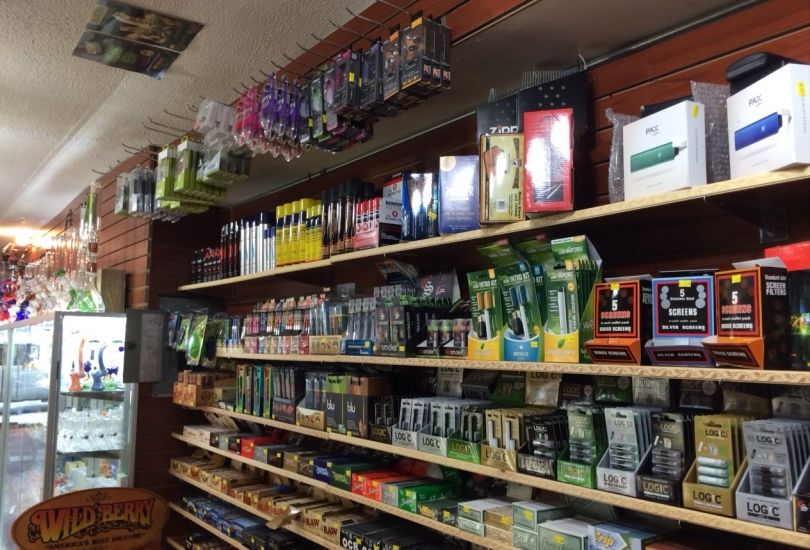
Where is `poster`? The width and height of the screenshot is (810, 550). poster is located at coordinates (130, 25).